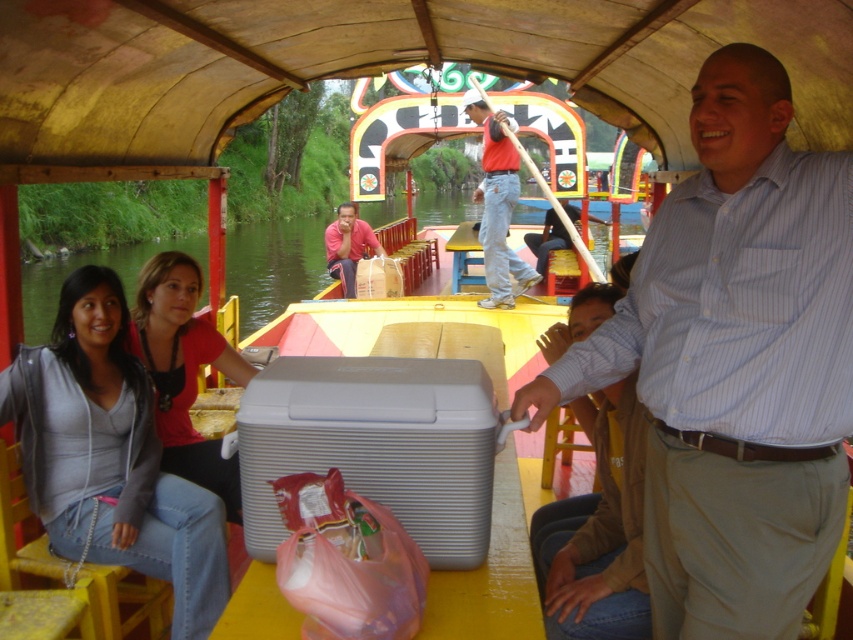
Which is above, matte gray jacket at lower left or matte red shirt at center?

matte red shirt at center

Is matte gray jacket at lower left above matte red shirt at center?

No.

At what (x,y) coordinates should I click in order to perform the action: click on matte gray jacket at lower left. Please return your answer as a coordinate pair (x, y). Looking at the image, I should click on (109, 456).

Locate an element on the screen. The height and width of the screenshot is (640, 853). matte gray jacket at lower left is located at coordinates (109, 456).

Measure the distance from green water at center to matte pink shirt at center.

The distance of green water at center from matte pink shirt at center is 29.60 meters.

Who is more forward, (198, 244) or (355, 243)?

Point (355, 243)

Does point (288, 275) come closer to viewer compared to point (351, 237)?

No, it is not.

I want to click on green water at center, so (274, 266).

Does green water at center have a greater width compared to matte red shirt at center?

Yes.

Is point (204, 301) farther from viewer compared to point (508, 154)?

That is False.

Who is more forward, [305,221] or [534,269]?

Point [534,269]

Where is `green water at center`? The width and height of the screenshot is (853, 640). green water at center is located at coordinates (274, 266).